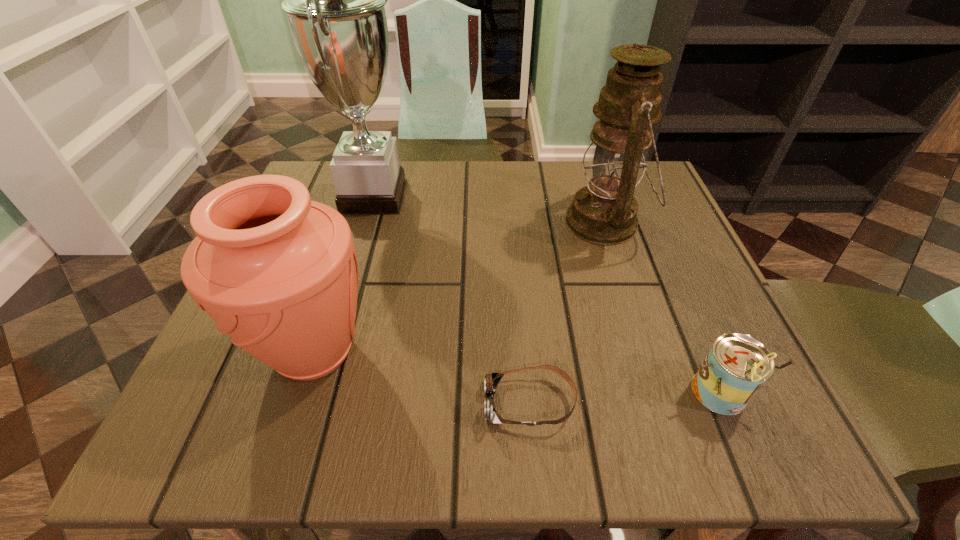
The width and height of the screenshot is (960, 540). In order to click on the tallest object in this screenshot , I will do `click(334, 0)`.

Where is `the second tallest object`? The width and height of the screenshot is (960, 540). the second tallest object is located at coordinates (605, 212).

At what (x,y) coordinates should I click in order to perform the action: click on the third shortest object. Please return your answer as a coordinate pair (x, y). The image size is (960, 540). Looking at the image, I should click on (278, 273).

Where is `can`? The width and height of the screenshot is (960, 540). can is located at coordinates (736, 367).

This screenshot has width=960, height=540. I want to click on the third object from right to left, so click(x=490, y=383).

Find the location of `goggles`. goggles is located at coordinates (490, 383).

Where is `vacant space situated 0.270m at the front view of the tallest object`? Image resolution: width=960 pixels, height=540 pixels. vacant space situated 0.270m at the front view of the tallest object is located at coordinates (532, 197).

The height and width of the screenshot is (540, 960). In order to click on free space located 0.060m on the right of the oil lamp in this screenshot , I will do `click(673, 222)`.

The image size is (960, 540). What are the coordinates of `blank space located 0.150m on the right of the third shortest object` in the screenshot? It's located at (472, 351).

This screenshot has width=960, height=540. What are the coordinates of `free space located 0.180m on the left of the second shortest object` in the screenshot? It's located at (557, 394).